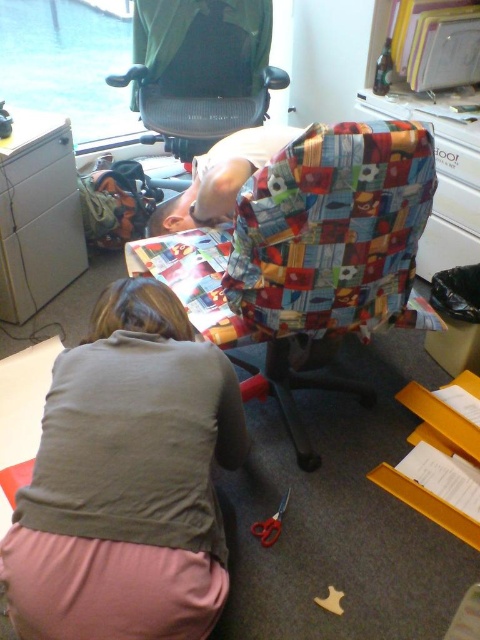
Based on the photo, you are organizing the office and need to place a new desk lamp between the green fabric swivel chair at upper center and the metallic gray filing cabinet at left. Which object should the lamp be closer to if it needs to be placed at the same height as the taller object?

The metallic gray filing cabinet at left is taller than the green fabric swivel chair at upper center. To place the desk lamp at the same height as the taller object, the lamp should be positioned closer to the metallic gray filing cabinet at left.

You are organizing the office and need to move the metallic gray filing cabinet at left. Can you move it without moving the green fabric swivel chair at upper center?

The green fabric swivel chair at upper center is positioned over the metallic gray filing cabinet at left, so you cannot move the filing cabinet without moving the chair first.